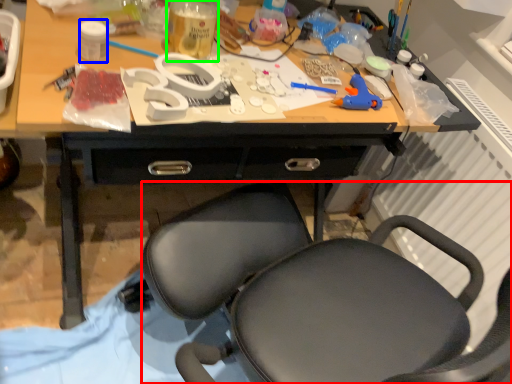
Question: Considering the real-world distances, which object is closest to chair (highlighted by a red box)? bottle (highlighted by a blue box) or bottle (highlighted by a green box).

Choices:
 (A) bottle
 (B) bottle

Answer: (B)